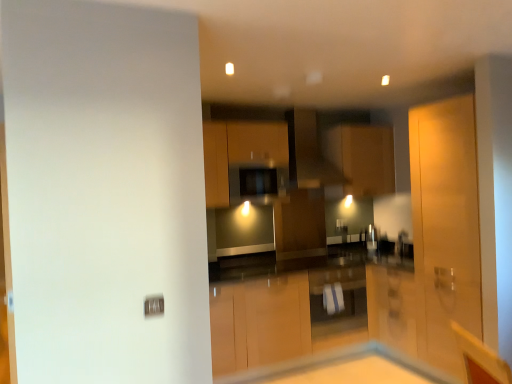
Question: Can you confirm if matte wood cabinet at center, the first cabinetry viewed from the top, is taller than matte wood cabinet at center, which appears as the 2th cabinetry when viewed from the top?

Choices:
 (A) yes
 (B) no

Answer: (A)

Question: Is matte wood cabinet at center, which is counted as the third cabinetry, starting from the bottom, touching matte wood cabinet at center, the 3th cabinetry from the right?

Choices:
 (A) yes
 (B) no

Answer: (B)

Question: Can you confirm if matte wood cabinet at center, the 3th cabinetry in the left-to-right sequence, is shorter than matte wood cabinet at center, which appears as the 2th cabinetry when viewed from the top?

Choices:
 (A) yes
 (B) no

Answer: (B)

Question: From a real-world perspective, is matte wood cabinet at center, the first cabinetry viewed from the top, physically above matte wood cabinet at center, which appears as the 2th cabinetry when viewed from the top?

Choices:
 (A) yes
 (B) no

Answer: (A)

Question: From the image's perspective, is matte wood cabinet at center, arranged as the first cabinetry when viewed from the right, beneath matte wood cabinet at center, which appears as the 2th cabinetry when viewed from the top?

Choices:
 (A) no
 (B) yes

Answer: (A)

Question: From the image's perspective, is matte black exhaust hood at center above or below white glossy cabinet at center, which is counted as the 1th cabinetry, starting from the bottom?

Choices:
 (A) below
 (B) above

Answer: (B)

Question: Do you think matte black exhaust hood at center is within white glossy cabinet at center, which appears as the 2th cabinetry when viewed from the left, or outside of it?

Choices:
 (A) inside
 (B) outside

Answer: (B)

Question: Looking at their shapes, would you say matte black exhaust hood at center is wider or thinner than white glossy cabinet at center, arranged as the 3th cabinetry when viewed from the top?

Choices:
 (A) wide
 (B) thin

Answer: (A)

Question: Would you say matte black exhaust hood at center is to the left or to the right of white glossy cabinet at center, which appears as the 2th cabinetry when viewed from the left, in the picture?

Choices:
 (A) left
 (B) right

Answer: (A)

Question: Does point (423, 369) appear closer or farther from the camera than point (369, 162)?

Choices:
 (A) closer
 (B) farther

Answer: (A)

Question: From the image's perspective, relative to matte wood cabinet at center, arranged as the first cabinetry when viewed from the right, is white glossy table at center above or below?

Choices:
 (A) below
 (B) above

Answer: (A)

Question: Considering their positions, is white glossy table at center located in front of or behind matte wood cabinet at center, arranged as the first cabinetry when viewed from the right?

Choices:
 (A) front
 (B) behind

Answer: (A)

Question: In terms of width, does white glossy table at center look wider or thinner when compared to matte wood cabinet at center, which is counted as the third cabinetry, starting from the bottom?

Choices:
 (A) wide
 (B) thin

Answer: (A)

Question: Relative to white glossy cabinet at center, which is counted as the 1th cabinetry, starting from the bottom, is white glossy table at center in front or behind?

Choices:
 (A) front
 (B) behind

Answer: (A)

Question: From the image's perspective, is white glossy table at center positioned above or below white glossy cabinet at center, arranged as the 3th cabinetry when viewed from the top?

Choices:
 (A) below
 (B) above

Answer: (A)